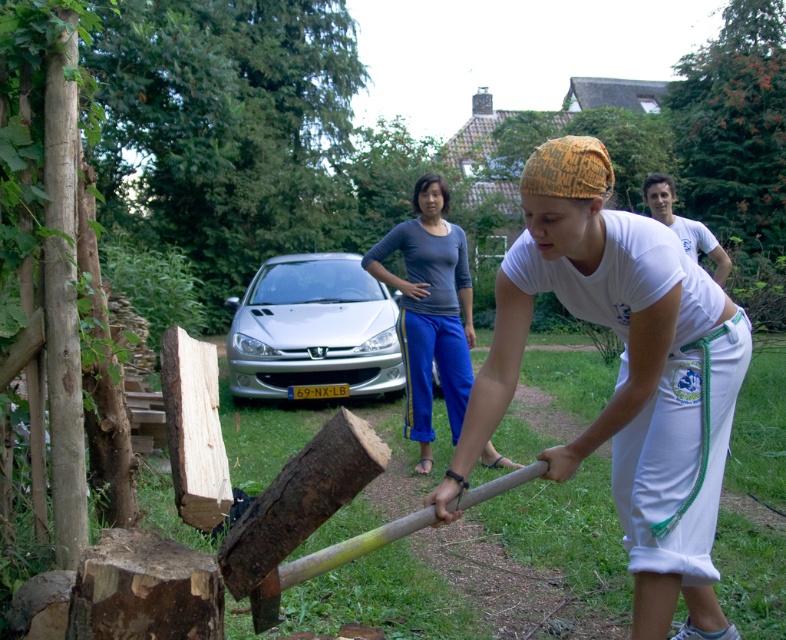
From the picture: You are a delivery person trying to park your delivery van which is 3 meters long. You see the silver metallic car at center and the dark gray cotton shirt at center. Is there enough space between them to park your van?

The distance between the silver metallic car at center and dark gray cotton shirt at center is 3.14 meters. Since the van is 3 meters long, there is sufficient space to park between them as 3.14 meters is greater than 3 meters.

You are a photographer trying to capture a clear photo of the dark gray cotton shirt at center and the silver metallic car at center. However, the car is blocking your view of the shirt. Can you move the car to the side to get a better shot?

The dark gray cotton shirt at center is behind the silver metallic car at center, so you cannot move the car to the side to get a better shot because the shirt is already behind the car.